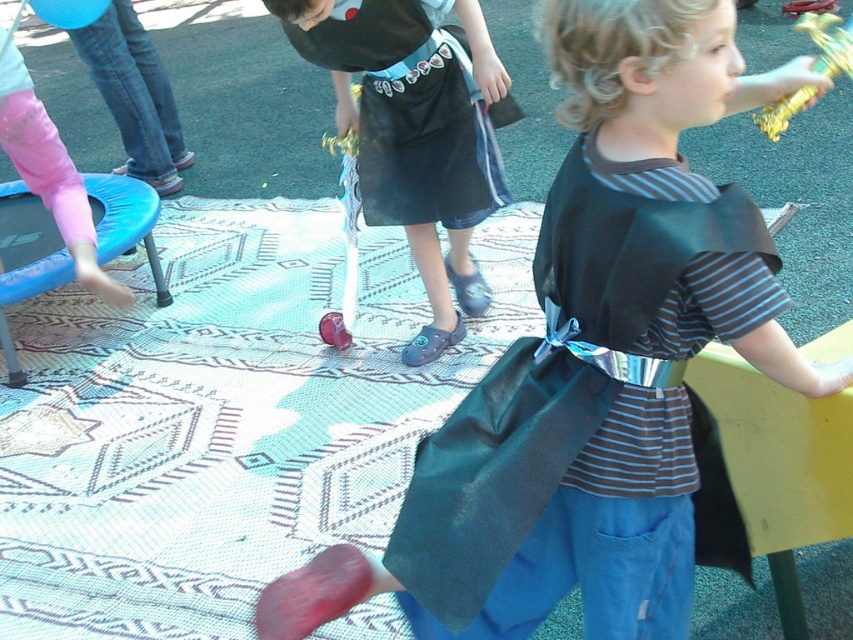
You are a child at a party and you see a rubberized red ball at center and a gold metallic wand at upper right. Which object is located higher in the image?

The gold metallic wand at upper right is higher in the image than the rubberized red ball at center.

You are standing in the park and see the shiny blue skirt at center. If you want to pick up a small toy that is 2 meters away from you, will you be able to reach it without moving?

The distance between you and the shiny blue skirt at center is 6.61 feet, which is approximately 2.016 meters. Since the toy is 2 meters away, you can reach it without moving.

You are a parent at the event and want to retrieve the gold metallic wand at upper right for your child. However, there is a shiny dark green cape at center in the way. Can you reach the wand without moving the cape?

The shiny dark green cape at center is positioned under the gold metallic wand at upper right, so you can reach the wand without moving the cape because it is above it.